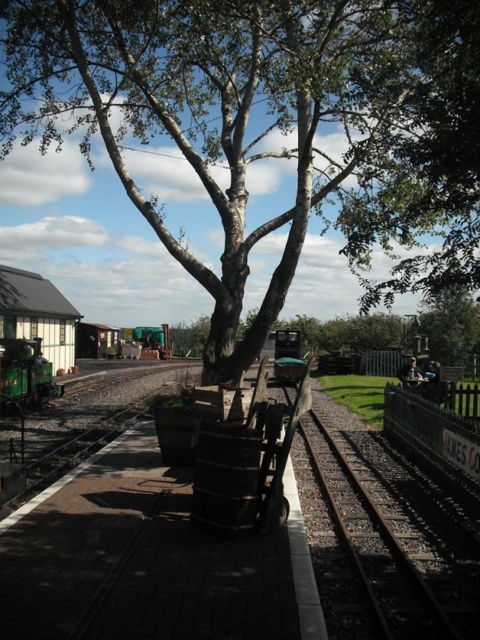
Question: Considering the real-world distances, which object is closest to the dark brown metal train track at center?

Choices:
 (A) green matte train at left
 (B) green leafy tree at center

Answer: (A)

Question: Estimate the real-world distances between objects in this image. Which object is farther from the green matte train at left?

Choices:
 (A) green leafy tree at center
 (B) dark brown metal train track at center

Answer: (A)

Question: Does green leafy tree at center have a smaller size compared to dark brown metal train track at center?

Choices:
 (A) yes
 (B) no

Answer: (B)

Question: Is dark brown metal train track at center thinner than green matte train at left?

Choices:
 (A) yes
 (B) no

Answer: (B)

Question: Is green leafy tree at center bigger than dark brown metal train track at center?

Choices:
 (A) no
 (B) yes

Answer: (B)

Question: Considering the real-world distances, which object is farthest from the green matte train at left?

Choices:
 (A) green leafy tree at center
 (B) dark brown metal train track at center

Answer: (A)